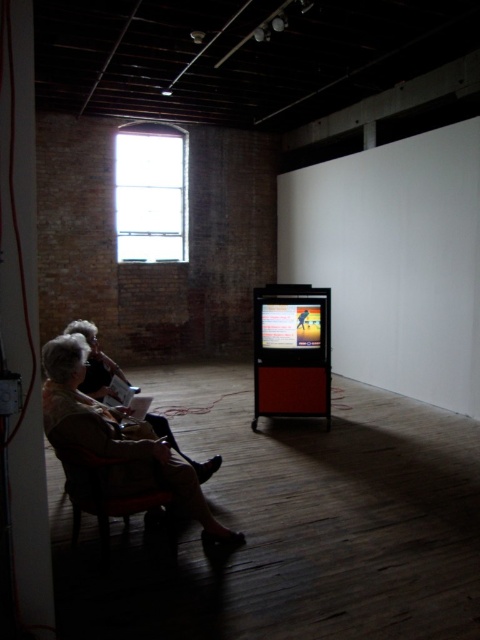
Between point (48, 356) and point (72, 452), which one is positioned behind?

The point (48, 356) is behind.

Is point (167, 449) behind point (90, 474)?

Yes, it is.

At what (x,y) coordinates should I click in order to perform the action: click on matte beige sweater at left. Please return your answer as a coordinate pair (x, y). This screenshot has height=640, width=480. Looking at the image, I should click on (119, 440).

Find the location of `matte beige sweater at left`. matte beige sweater at left is located at coordinates (119, 440).